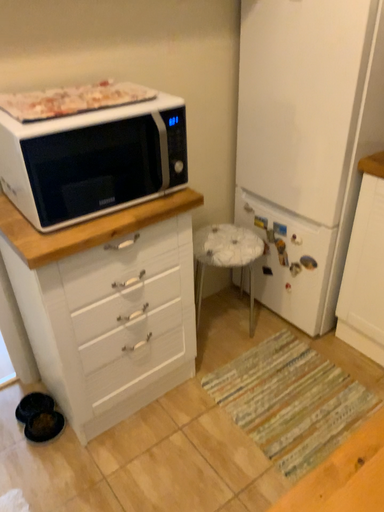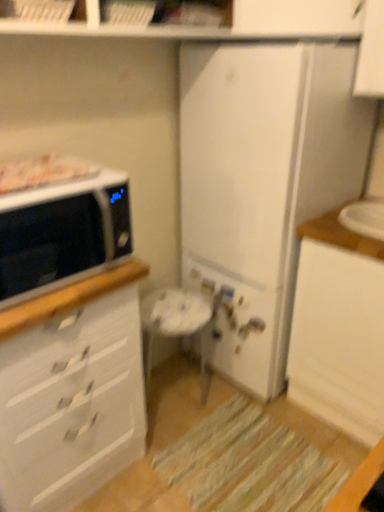
Question: Which way did the camera rotate in the video?

Choices:
 (A) rotated downward
 (B) rotated upward

Answer: (B)